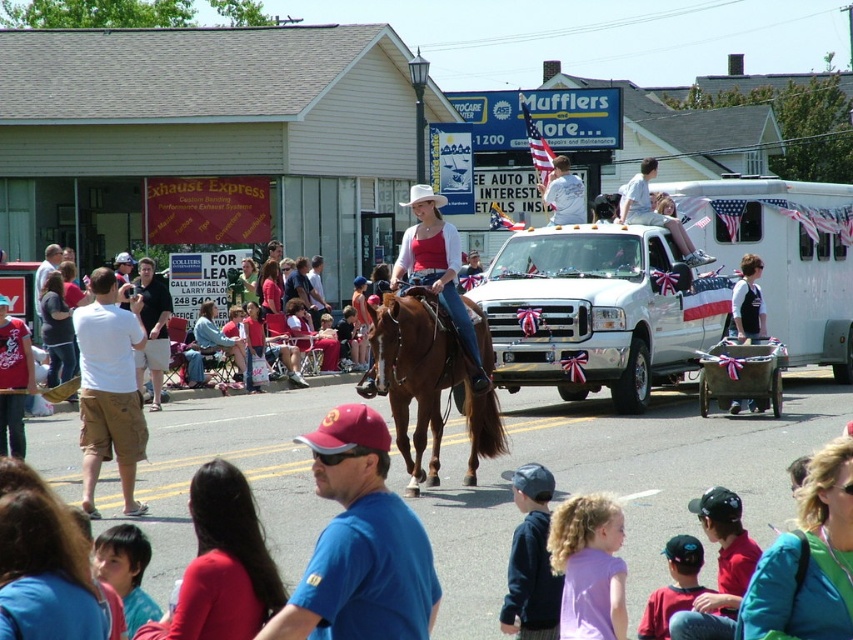
Is white cotton shirt at left further to camera compared to dark gray cotton t-shirt at center?

No, white cotton shirt at left is in front of dark gray cotton t-shirt at center.

Can you confirm if white cotton shirt at left is thinner than dark gray cotton t-shirt at center?

Correct, white cotton shirt at left's width is less than dark gray cotton t-shirt at center's.

Between point (129, 477) and point (154, 300), which one is positioned behind?

The point (154, 300) is behind.

This screenshot has height=640, width=853. I want to click on white cotton shirt at left, so click(x=109, y=388).

Which is above, blue fabric shirt at center or dark gray cotton t-shirt at center?

dark gray cotton t-shirt at center is higher up.

Is blue fabric shirt at center thinner than dark gray cotton t-shirt at center?

Correct, blue fabric shirt at center's width is less than dark gray cotton t-shirt at center's.

What do you see at coordinates (358, 545) in the screenshot?
I see `blue fabric shirt at center` at bounding box center [358, 545].

This screenshot has height=640, width=853. In order to click on blue fabric shirt at center in this screenshot , I will do `click(358, 545)`.

What do you see at coordinates (358, 545) in the screenshot? I see `blue fabric shirt at center` at bounding box center [358, 545].

Can you confirm if blue fabric shirt at center is positioned to the right of brown glossy horse at center?

Indeed, blue fabric shirt at center is positioned on the right side of brown glossy horse at center.

Does point (355, 426) come behind point (395, 336)?

No, it is not.

Where is `blue fabric shirt at center`? blue fabric shirt at center is located at coordinates (358, 545).